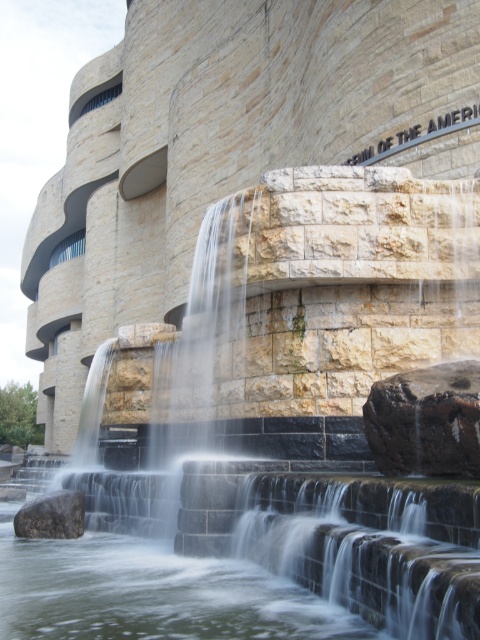
Question: Is dark brown rock at center wider than brown rough rock at lower left?

Choices:
 (A) yes
 (B) no

Answer: (A)

Question: Is smooth stone waterfall at center closer to the viewer compared to clear stone water at center?

Choices:
 (A) no
 (B) yes

Answer: (A)

Question: Among these points, which one is nearest to the camera?

Choices:
 (A) (266, 396)
 (B) (129, 616)
 (C) (451, 406)
 (D) (24, 529)

Answer: (B)

Question: Based on their relative distances, which object is nearer to the smooth stone waterfall at center?

Choices:
 (A) clear stone water at center
 (B) dark brown rock at center
 (C) brown rough rock at lower left

Answer: (A)

Question: From the image, what is the correct spatial relationship of smooth stone waterfall at center in relation to brown rough rock at lower left?

Choices:
 (A) above
 (B) below

Answer: (A)

Question: Which object is closer to the camera taking this photo?

Choices:
 (A) brown rough rock at lower left
 (B) smooth stone waterfall at center
 (C) clear stone water at center
 (D) dark brown rock at center

Answer: (C)